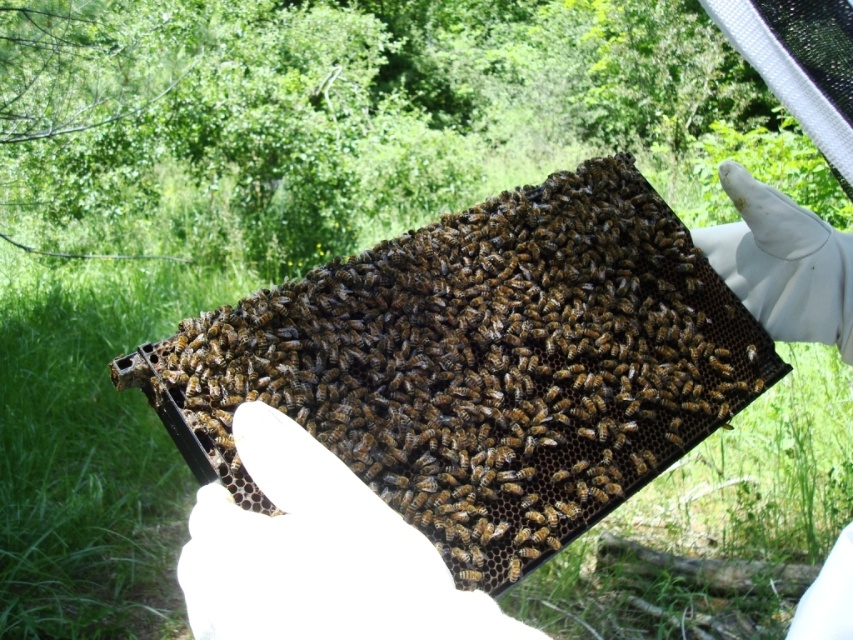
Is brown matte honeycomb at center thinner than white glove at center?

In fact, brown matte honeycomb at center might be wider than white glove at center.

Does point (198, 330) come in front of point (807, 330)?

Yes, it is in front of point (807, 330).

I want to click on brown matte honeycomb at center, so click(480, 365).

Who is more distant from viewer, (x=570, y=394) or (x=750, y=360)?

The point (x=750, y=360) is behind.

Describe the element at coordinates (480, 365) in the screenshot. I see `brown matte honeycomb at center` at that location.

Is point (524, 330) more distant than point (753, 346)?

No, it is in front of (753, 346).

I want to click on brown matte honeycomb at center, so click(x=480, y=365).

Is white glove at center in front of brown fuzzy bee at center?

Yes, white glove at center is closer to the viewer.

Is white glove at center below brown fuzzy bee at center?

No.

Between point (848, 566) and point (753, 348), which one is positioned behind?

The point (753, 348) is more distant.

Where is `white glove at center`? This screenshot has width=853, height=640. white glove at center is located at coordinates (782, 262).